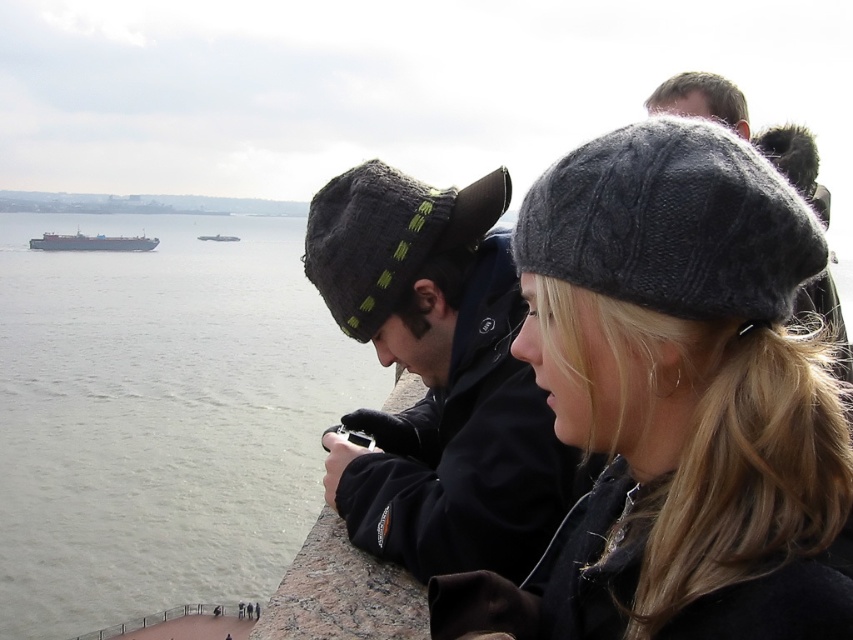
Does knitted gray hat at center appear on the left side of gray matte water at center?

No, knitted gray hat at center is not to the left of gray matte water at center.

What do you see at coordinates (674, 401) in the screenshot? I see `knitted gray hat at center` at bounding box center [674, 401].

Find the location of a particular element. The width and height of the screenshot is (853, 640). knitted gray hat at center is located at coordinates (674, 401).

Which is above, knitted gray hat at center or metallic gray ship at left?

Positioned higher is metallic gray ship at left.

Between knitted gray hat at center and metallic gray ship at left, which one appears on the right side from the viewer's perspective?

knitted gray hat at center

Is point (614, 259) closer to camera compared to point (204, 237)?

Yes, it is in front of point (204, 237).

Where is `knitted gray hat at center`? This screenshot has width=853, height=640. knitted gray hat at center is located at coordinates (674, 401).

Which is in front, point (96, 260) or point (412, 544)?

Point (412, 544) is in front.

Is gray matte water at center above dark gray knit hat at center?

Yes.

Is point (154, 310) positioned after point (436, 556)?

Yes, point (154, 310) is behind point (436, 556).

This screenshot has width=853, height=640. Identify the location of gray matte water at center. (160, 417).